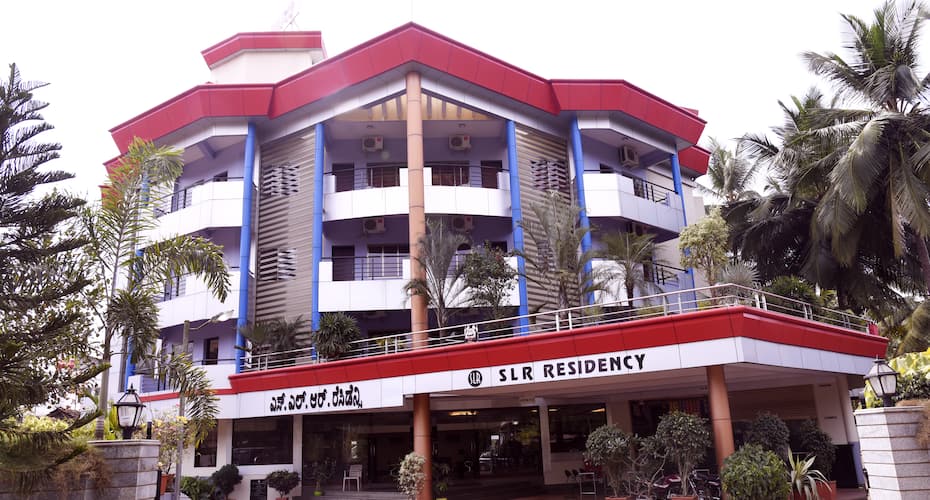
This screenshot has width=930, height=500. I want to click on air conditioning units, so click(372, 142), click(461, 141), click(622, 157), click(636, 230), click(456, 217), click(364, 228).